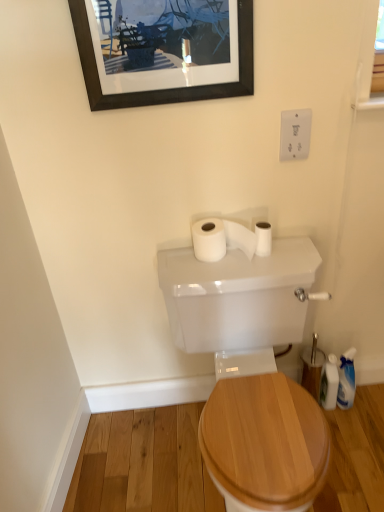
Find the location of a particular element. The image size is (384, 512). vacant position to the left of white glossy toilet tank at center is located at coordinates (131, 460).